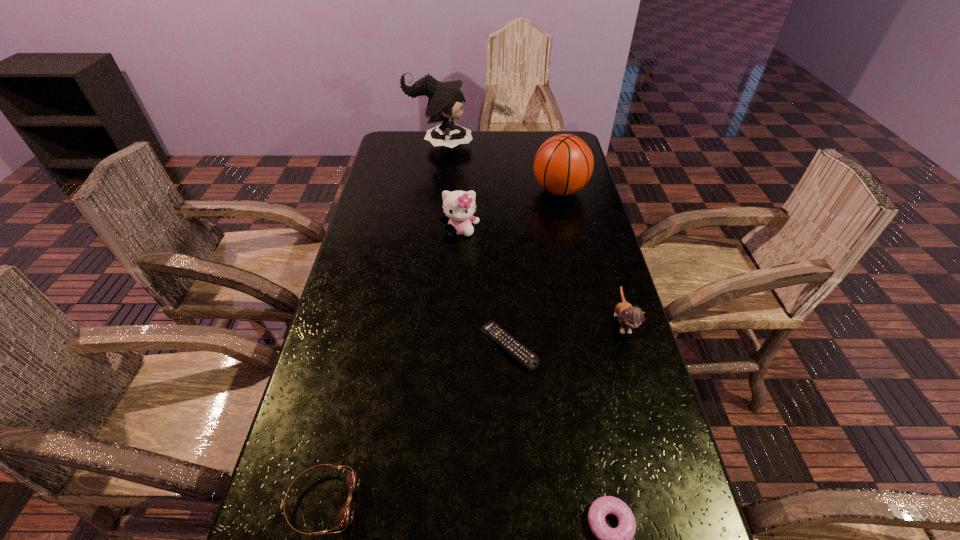
Where is `basketball that is at the right edge`? basketball that is at the right edge is located at coordinates (563, 164).

This screenshot has width=960, height=540. Identify the location of kitten located in the right edge section of the desktop. [x=629, y=317].

Where is `object located at the far left corner`? The image size is (960, 540). object located at the far left corner is located at coordinates (445, 101).

Locate an element on the screen. The image size is (960, 540). vacant space at the far edge of the desktop is located at coordinates (453, 159).

This screenshot has width=960, height=540. I want to click on free space at the left edge, so pos(373,230).

The image size is (960, 540). I want to click on vacant position at the right edge of the desktop, so click(607, 429).

The height and width of the screenshot is (540, 960). Find the location of `unoccupied position between the taller kitten and the third shortest object`. unoccupied position between the taller kitten and the third shortest object is located at coordinates (391, 366).

Identify the location of unoccupied area between the sixth nearest object and the fifth tallest object. The width and height of the screenshot is (960, 540). (441, 347).

Locate an element on the screen. This screenshot has width=960, height=540. free space between the fourth object from right to left and the basketball is located at coordinates (534, 268).

This screenshot has height=540, width=960. I want to click on vacant space in between the shortest object and the nearer kitten, so click(x=565, y=335).